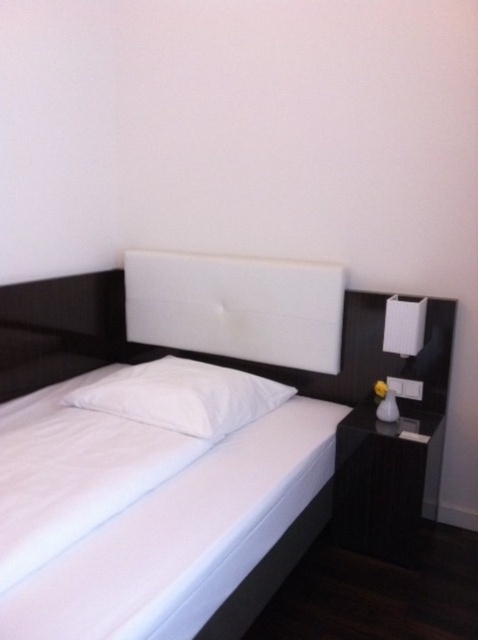
You are planning to place a new rectangular decorative item that is 1 meter in length on your white leather bed at center. Considering the size of the white glossy lamp at right, will the decorative item fit on the bed without overlapping the lamp?

The white leather bed at center is wider than the white glossy lamp at right, so the decorative item of 1 meter length can fit on the bed without overlapping the lamp as long as it is placed appropriately.

You are standing in the center of the room and want to move towards the white leather bed at center. Which direction should you move?

Since the white leather bed at center is located at point 2D coordinates of [192,442], you should move towards the direction where the x coordinate increases to reach it.